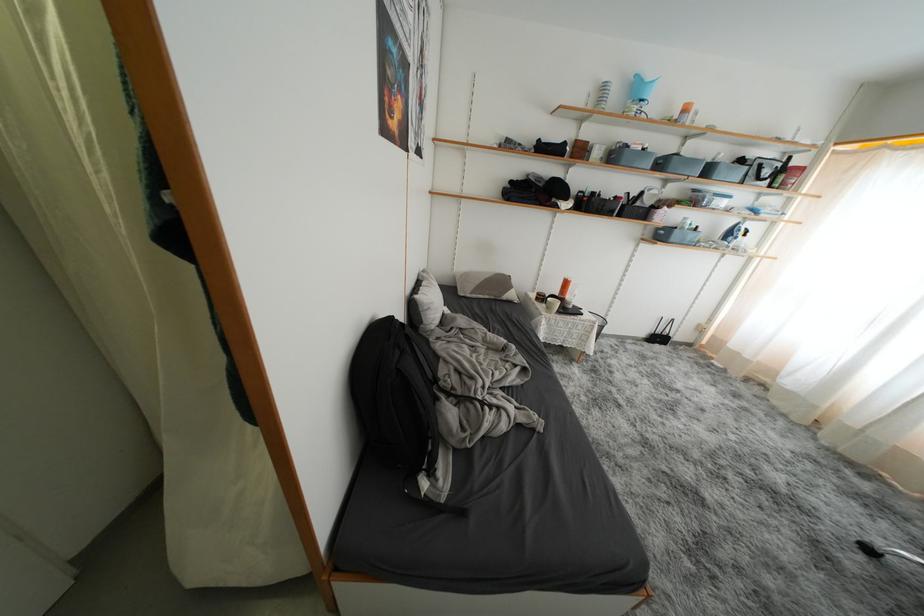
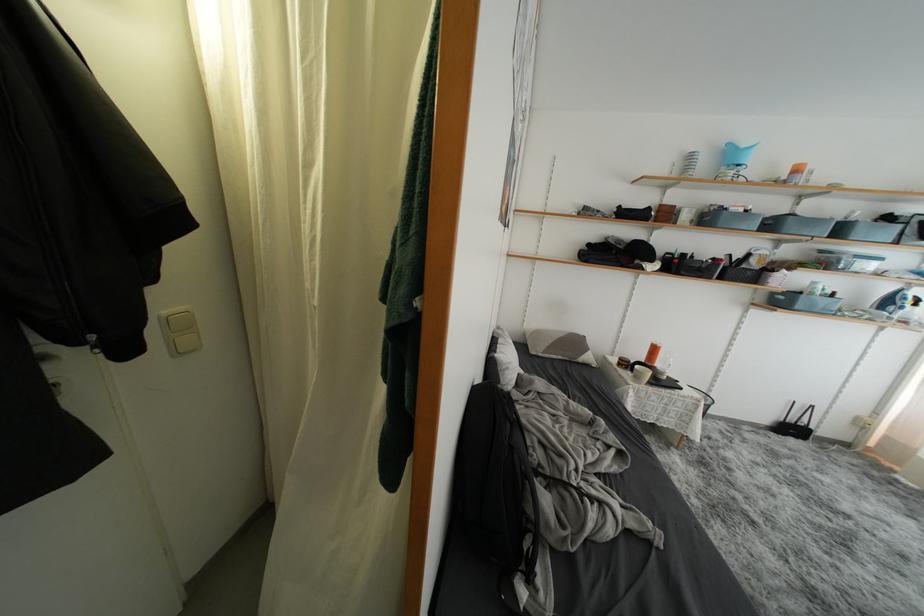
Find the pixel in the second image that matches (x=654, y=238) in the first image.

(767, 304)